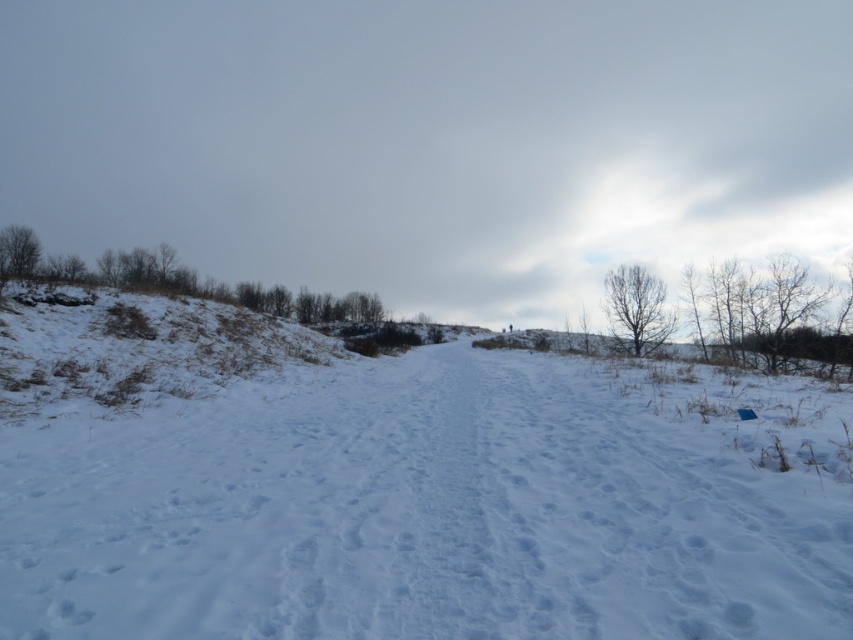
You are a photographer standing at the camera position. You want to capture a closeup shot of the white fluffy snow at center. Considering the distance between you and the snow, do you think you can walk directly to the snow to get the shot?

The white fluffy snow at center and camera are 43.27 meters apart from each other. Since the distance is quite far, you would need a long focal length lens to capture a closeup without physically moving closer. Walking directly to the snow might not be necessary if the equipment allows.

You are an explorer trying to cross the white fluffy snow at center. There is a brown grassy hillside at left nearby. Which direction should you go to avoid the hillside?

The white fluffy snow at center is in front of the brown grassy hillside at left, so to avoid the hillside, you should go in the opposite direction of the hillside, which would be towards the right side.

You are planning to build a snowman using the white fluffy snow at center and the brown grassy hillside at left. Which area provides enough space for the base of the snowman?

The white fluffy snow at center might be wider than brown grassy hillside at left, so it is more likely to provide enough space for the base of the snowman.